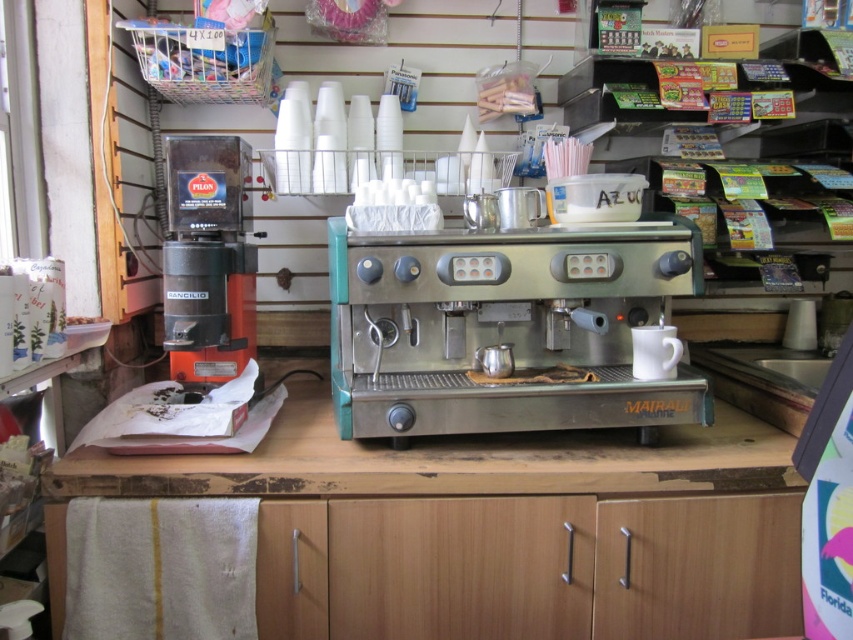
Measure the distance between wooden at center and orange matte coffee machine at left.

14.43 inches

Which is more to the right, wooden at center or orange matte coffee machine at left?

wooden at center is more to the right.

Between point (444, 445) and point (201, 170), which one is positioned behind?

The point (201, 170) is behind.

Identify the location of wooden at center. (445, 461).

Is stainless steel espresso machine at center smaller than wooden at center?

Indeed, stainless steel espresso machine at center has a smaller size compared to wooden at center.

Who is more forward, (416, 276) or (775, 438)?

Point (416, 276) is in front.

I want to click on stainless steel espresso machine at center, so click(506, 328).

From the picture: Which is above, stainless steel espresso machine at center or orange matte coffee machine at left?

orange matte coffee machine at left

Does stainless steel espresso machine at center have a greater height compared to orange matte coffee machine at left?

No.

Find the location of a particular element. The image size is (853, 640). stainless steel espresso machine at center is located at coordinates (506, 328).